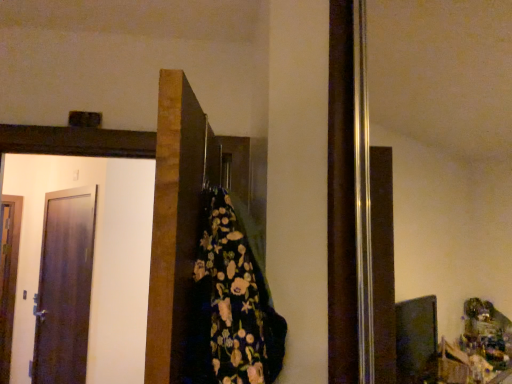
Question: Does matte dark brown door at left, acting as the 2th door starting from the back, touch dark brown wooden door at center, arranged as the 3th door when viewed from the left?

Choices:
 (A) yes
 (B) no

Answer: (B)

Question: From a real-world perspective, does matte dark brown door at left, placed as the 2th door when sorted from front to back, stand above dark brown wooden door at center, arranged as the 1th door when viewed from the right?

Choices:
 (A) yes
 (B) no

Answer: (B)

Question: Is matte dark brown door at left, arranged as the 2th door when viewed from the left, in front of dark brown wooden door at center, arranged as the 1th door when viewed from the right?

Choices:
 (A) yes
 (B) no

Answer: (B)

Question: Can you confirm if matte dark brown door at left, acting as the 2th door starting from the back, is positioned to the right of dark brown wooden door at center, arranged as the 3th door when viewed from the left?

Choices:
 (A) no
 (B) yes

Answer: (A)

Question: From a real-world perspective, is matte dark brown door at left, the 2th door when ordered from right to left, under dark brown wooden door at center, arranged as the 3th door when viewed from the left?

Choices:
 (A) yes
 (B) no

Answer: (A)

Question: Does matte dark brown door at left, placed as the 2th door when sorted from front to back, turn towards dark brown wooden door at center, arranged as the 1th door when viewed from the right?

Choices:
 (A) no
 (B) yes

Answer: (A)

Question: From a real-world perspective, is floral-patterned fabric at center under matte dark brown door at left, placed as the 2th door when sorted from front to back?

Choices:
 (A) yes
 (B) no

Answer: (B)

Question: Is floral-patterned fabric at center placed right next to matte dark brown door at left, acting as the 2th door starting from the back?

Choices:
 (A) no
 (B) yes

Answer: (A)

Question: Considering the relative sizes of floral-patterned fabric at center and matte dark brown door at left, acting as the 2th door starting from the back, in the image provided, is floral-patterned fabric at center shorter than matte dark brown door at left, acting as the 2th door starting from the back,?

Choices:
 (A) no
 (B) yes

Answer: (B)

Question: From a real-world perspective, is floral-patterned fabric at center on top of matte dark brown door at left, acting as the 2th door starting from the back?

Choices:
 (A) no
 (B) yes

Answer: (B)

Question: Is matte dark brown door at left, acting as the 2th door starting from the back, completely or partially inside floral-patterned fabric at center?

Choices:
 (A) no
 (B) yes

Answer: (A)

Question: Is floral-patterned fabric at center wider than matte dark brown door at left, placed as the 2th door when sorted from front to back?

Choices:
 (A) yes
 (B) no

Answer: (A)

Question: Does dark brown wooden door at center, the 3th door positioned from the back, lie behind matte dark brown door at left, placed as the 2th door when sorted from front to back?

Choices:
 (A) no
 (B) yes

Answer: (A)